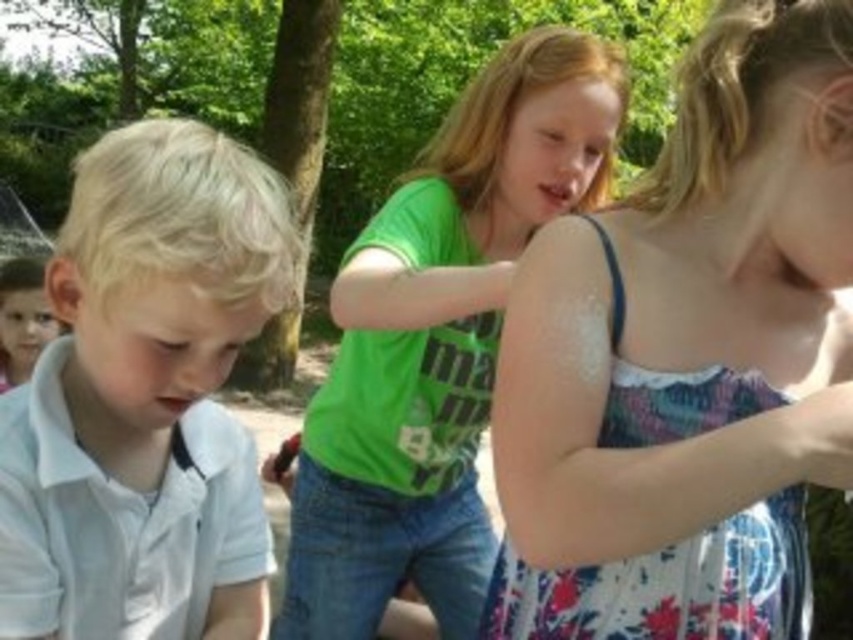
You are standing in the park and see the white matte shirt at left and the green matte shirt at center. Which shirt is nearer to you?

The white matte shirt at left is closer to the viewer than the green matte shirt at center, so the white matte shirt at left is nearer to you.

You are a photographer trying to capture a group photo of the two children in the scene. The camera you are using has a maximum focus range of 16 inches. Can you take a photo that includes both the floral dress at upper right and the white matte shirt at left without moving either child?

The distance between the floral dress at upper right and the white matte shirt at left is 17.09 inches. Since the camera can only focus within 16 inches, it will not be able to capture both subjects clearly in the same frame without moving them closer together.